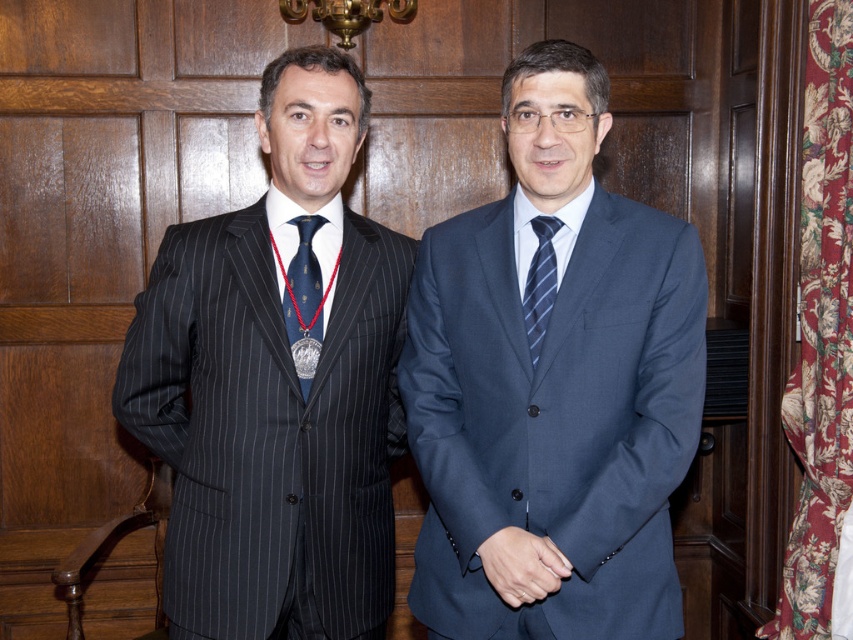
You are an event planner arranging a photo shoot in this setting. You need to place a small podium exactly at the point marked by the coordinates point (553, 387). Which object from the scene will the podium be placed near?

The podium will be placed near the blue smooth suit at center, as the coordinates point (553, 387) indicate that location.

You are a photographer trying to capture a photo of both men in the image. You notice two points marked in the image. The first point is at coordinate point (582,436) and the second point is at coordinate point (541,220). Since you want to ensure both men are in focus, which point should you focus on to include both in the depth of field?

Point (582,436) is in front of point (541,220). To include both in the depth of field, focus on the point that is between them, which would be closer to the front point. However, since the question specifies choosing between the two given points, focusing on the rear point might allow the front point to be within the depth of field range. But according to the description, since point (582,436) is in front, focusing on it would mean the rear point might be out of focus. To ensure both are in focus,

You are a photographer setting up for a formal event. You need to ensure that the pinstriped suit at left and the blue silk tie at left are both visible in the frame. Given their sizes, which object will require more vertical space in the photo?

The pinstriped suit at left is taller than the blue silk tie at left, so it will require more vertical space in the photo.